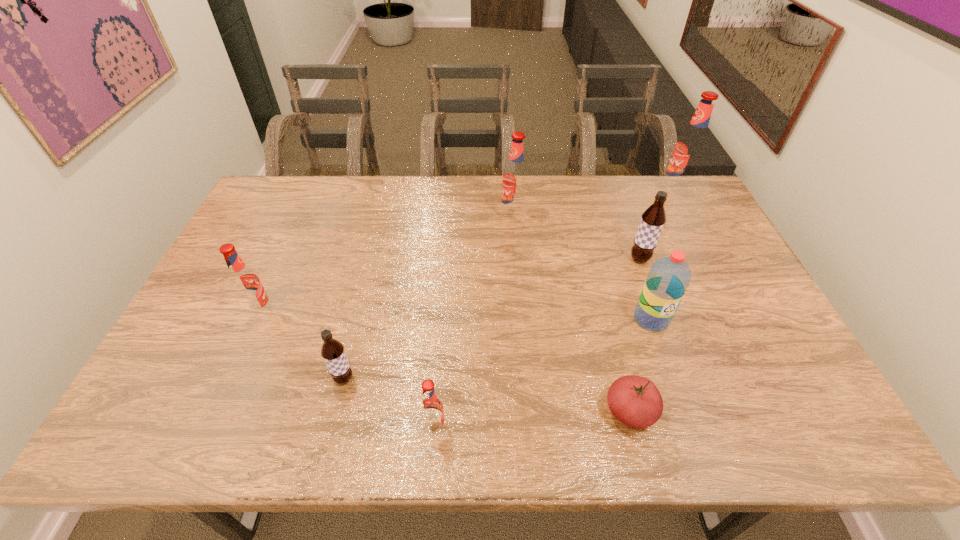
Identify the location of unoccupied position between the nearer brown root beer and the shortest object. This screenshot has width=960, height=540. (487, 395).

Where is `vacant space in between the water bottle and the smaller brown root beer`? The height and width of the screenshot is (540, 960). vacant space in between the water bottle and the smaller brown root beer is located at coordinates (497, 349).

Where is `object that is the second nearest to the leftmost red root beer`? object that is the second nearest to the leftmost red root beer is located at coordinates (431, 409).

Find the location of a particular element. This screenshot has height=540, width=960. the third closest object to the sixth object from right to left is located at coordinates (245, 283).

Locate an element on the screen. The image size is (960, 540). root beer identified as the fifth closest to the farthest root beer is located at coordinates (245, 283).

Select which root beer is the fourth closest to the red tomato. Please provide its 2D coordinates. Your answer should be formatted as a tuple, i.e. [(x, y)], where the tuple contains the x and y coordinates of a point satisfying the conditions above.

[(515, 177)]

Point out which red root beer is positioned as the second nearest to the second biggest red root beer. Please provide its 2D coordinates. Your answer should be formatted as a tuple, i.e. [(x, y)], where the tuple contains the x and y coordinates of a point satisfying the conditions above.

[(431, 409)]

Locate which red root beer ranks fourth in proximity to the fourth object from right to left. Please provide its 2D coordinates. Your answer should be formatted as a tuple, i.e. [(x, y)], where the tuple contains the x and y coordinates of a point satisfying the conditions above.

[(245, 283)]

Where is `vacant position in the image that satisfies the following two spatial constraints: 1. on the front side of the seventh object from right to left; 2. on the left side of the tomato`? vacant position in the image that satisfies the following two spatial constraints: 1. on the front side of the seventh object from right to left; 2. on the left side of the tomato is located at coordinates (336, 411).

The width and height of the screenshot is (960, 540). I want to click on vacant area that satisfies the following two spatial constraints: 1. on the back side of the fifth object from left to right; 2. on the right side of the second red root beer from left to right, so click(436, 411).